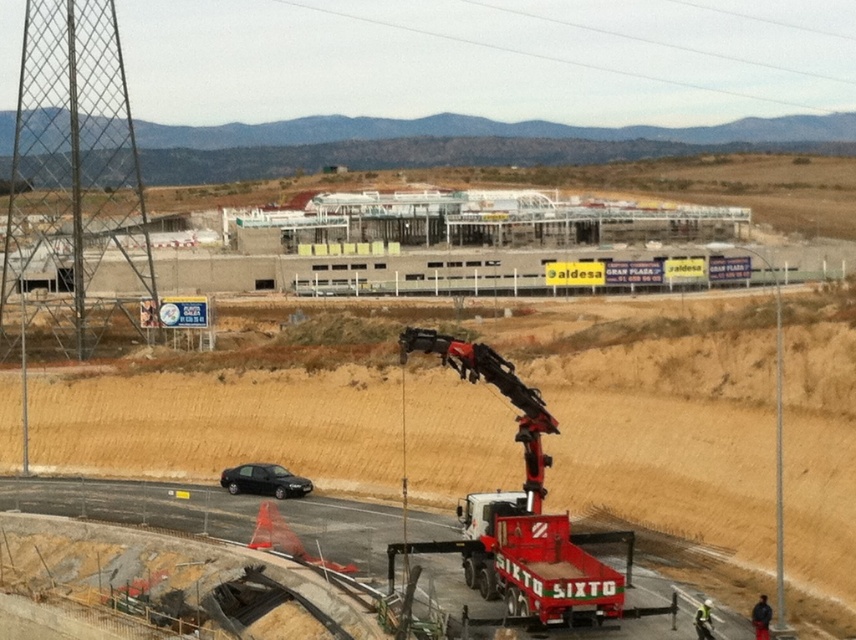
Which is in front, point (167, 442) or point (575, 582)?

Positioned in front is point (575, 582).

Is point (749, 388) positioned in front of point (388, 564)?

No, (749, 388) is further to viewer.

At what (x,y) coordinates should I click in order to perform the action: click on white concrete building at center. Please return your answer as a coordinate pair (x, y). The width and height of the screenshot is (856, 640). Looking at the image, I should click on (518, 372).

Between red matte trailer truck at lower right and black matte sedan at lower left, which one has less height?

Standing shorter between the two is black matte sedan at lower left.

Does point (510, 493) lie behind point (248, 484)?

No.

The height and width of the screenshot is (640, 856). Find the location of `red matte trailer truck at lower right`. red matte trailer truck at lower right is located at coordinates (520, 513).

This screenshot has width=856, height=640. Find the location of `red matte trailer truck at lower right`. red matte trailer truck at lower right is located at coordinates click(520, 513).

Does white concrete building at center have a smaller size compared to black asphalt highway at lower center?

Incorrect, white concrete building at center is not smaller in size than black asphalt highway at lower center.

Measure the distance between white concrete building at center and camera.

white concrete building at center is 55.37 meters away from camera.

This screenshot has width=856, height=640. Identify the location of white concrete building at center. (518, 372).